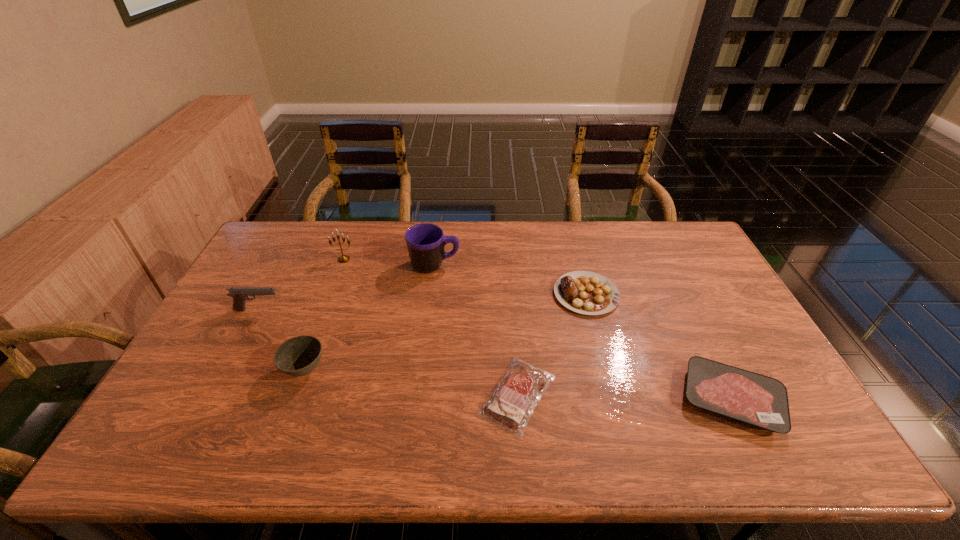
Locate which object is the sixth closest to the candelabrum. Please provide its 2D coordinates. Your answer should be formatted as a tuple, i.e. [(x, y)], where the tuple contains the x and y coordinates of a point satisfying the conditions above.

[(761, 401)]

At what (x,y) coordinates should I click in order to perform the action: click on the closest steak to the mug. Please return your answer as a coordinate pair (x, y). This screenshot has height=540, width=960. Looking at the image, I should click on (584, 292).

This screenshot has width=960, height=540. What are the coordinates of `steak that is the closest one to the mug` in the screenshot? It's located at (584, 292).

Where is `vacant area in the image that satisfies the following two spatial constraints: 1. on the front side of the tallest steak; 2. at the barrel of the third tallest object`? Image resolution: width=960 pixels, height=540 pixels. vacant area in the image that satisfies the following two spatial constraints: 1. on the front side of the tallest steak; 2. at the barrel of the third tallest object is located at coordinates (590, 310).

You are a GUI agent. You are given a task and a screenshot of the screen. Output one action in this format:
    pyautogui.click(x=<x>, y=<y>)
    Task: Click on the free location that satisfies the following two spatial constraints: 1. with the handle on the side of the mug; 2. on the back side of the sixth tallest object
    
    Given the screenshot: What is the action you would take?
    pyautogui.click(x=419, y=399)

Find the location of a particular element. vacant region that satisfies the following two spatial constraints: 1. at the barrel of the leftmost object; 2. on the back side of the shortest object is located at coordinates (212, 395).

At what (x,y) coordinates should I click in order to perform the action: click on vacant region that satisfies the following two spatial constraints: 1. on the front side of the fifth object from left to right; 2. on the right side of the fourth tallest object. Please return your answer as a coordinate pair (x, y). Looking at the image, I should click on (296, 395).

Locate an element on the screen. The height and width of the screenshot is (540, 960). vacant area that satisfies the following two spatial constraints: 1. on the front side of the bowl; 2. on the right side of the rightmost object is located at coordinates (295, 399).

At what (x,y) coordinates should I click in order to perform the action: click on free region that satisfies the following two spatial constraints: 1. with the handle on the side of the mug; 2. on the right side of the tallest steak. Please return your answer as a coordinate pair (x, y). This screenshot has width=960, height=540. Looking at the image, I should click on (431, 294).

The image size is (960, 540). What are the coordinates of `blank space that satisfies the following two spatial constraints: 1. on the front side of the candelabrum; 2. on the left side of the fifth object from left to right` in the screenshot? It's located at (294, 395).